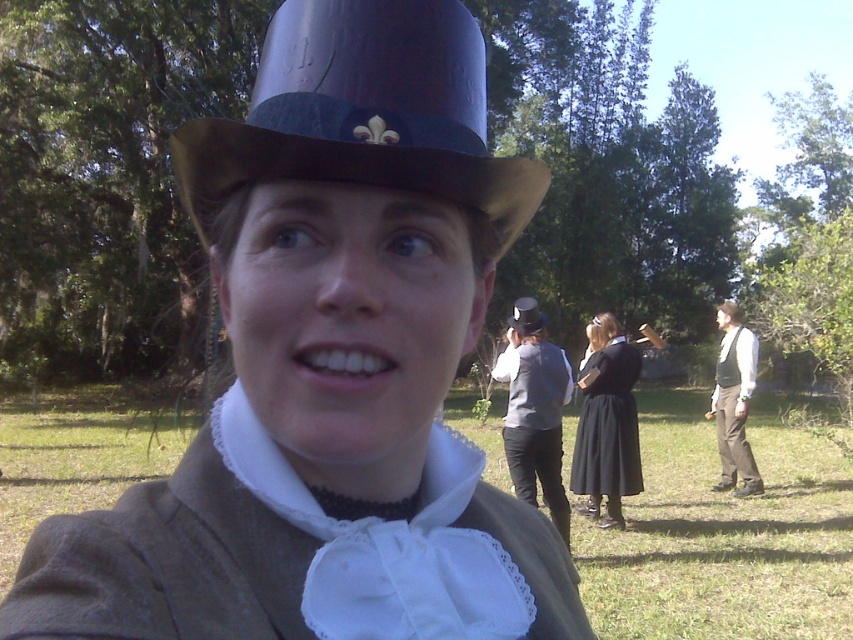
What do you see at coordinates (364, 115) in the screenshot? I see `shiny purple dress hat at upper center` at bounding box center [364, 115].

Is shiny purple dress hat at upper center to the right of brown leather vest at right from the viewer's perspective?

No, shiny purple dress hat at upper center is not to the right of brown leather vest at right.

Is point (418, 92) farther from viewer compared to point (717, 422)?

No.

Image resolution: width=853 pixels, height=640 pixels. I want to click on shiny purple dress hat at upper center, so click(364, 115).

Describe the element at coordinates (534, 410) in the screenshot. The width and height of the screenshot is (853, 640). I see `matte gray vest at center` at that location.

Does matte gray vest at center have a smaller size compared to black satin dress at center?

No, matte gray vest at center is not smaller than black satin dress at center.

Where is `matte gray vest at center`? This screenshot has width=853, height=640. matte gray vest at center is located at coordinates (534, 410).

Can you confirm if black satin dress at center is positioned to the left of brown leather vest at right?

Indeed, black satin dress at center is positioned on the left side of brown leather vest at right.

Is point (614, 336) farther from camera compared to point (752, 365)?

No, (614, 336) is closer to viewer.

At what (x,y) coordinates should I click in order to perform the action: click on black satin dress at center. Please return your answer as a coordinate pair (x, y). Image resolution: width=853 pixels, height=640 pixels. Looking at the image, I should click on (606, 422).